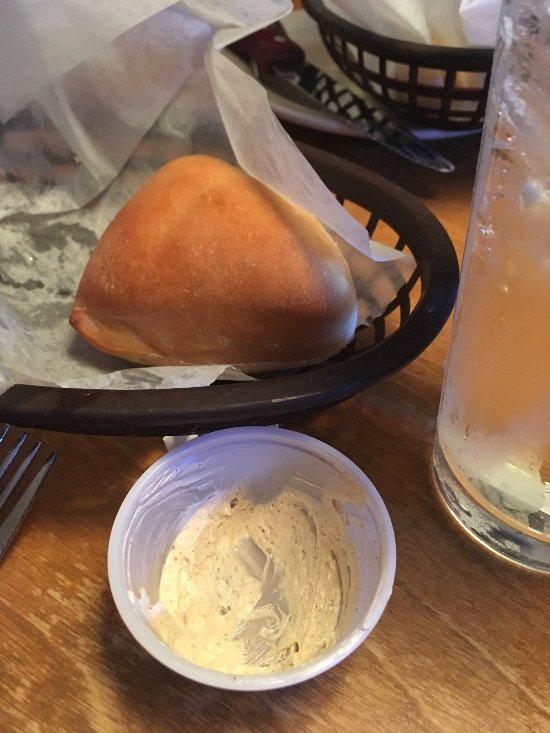
Find the location of a particular element. The image size is (550, 733). plate is located at coordinates (295, 116).